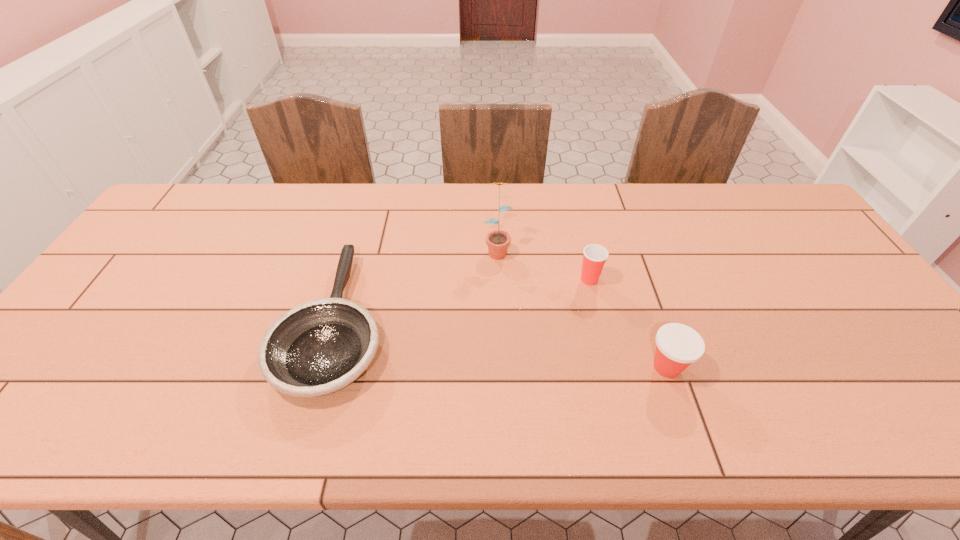
Where is `empty location between the tallest object and the second object from right to left`? empty location between the tallest object and the second object from right to left is located at coordinates 543,264.

The width and height of the screenshot is (960, 540). In order to click on free point between the second object from left to right and the shortest object in this screenshot , I will do `click(416, 286)`.

Where is `empty location between the tallest object and the farther Dixie cup`? empty location between the tallest object and the farther Dixie cup is located at coordinates click(x=543, y=264).

Locate an element on the screen. vacant space that is in between the frying pan and the second object from right to left is located at coordinates (463, 301).

At what (x,y) coordinates should I click in order to perform the action: click on vacant area between the right Dixie cup and the leftmost object. Please return your answer as a coordinate pair (x, y). This screenshot has height=540, width=960. Looking at the image, I should click on (501, 345).

The height and width of the screenshot is (540, 960). In order to click on unoccupied position between the second object from left to right and the second object from right to left in this screenshot , I will do `click(543, 264)`.

Where is `vacant space that is in between the left Dixie cup and the right Dixie cup`? The width and height of the screenshot is (960, 540). vacant space that is in between the left Dixie cup and the right Dixie cup is located at coordinates (628, 323).

Where is `blank region between the shortest object and the farther Dixie cup`? The width and height of the screenshot is (960, 540). blank region between the shortest object and the farther Dixie cup is located at coordinates (463, 301).

This screenshot has width=960, height=540. Identify the location of object that stands as the closest to the left Dixie cup. (497, 241).

Select which object is the second closest to the rightmost object. Please provide its 2D coordinates. Your answer should be formatted as a tuple, i.e. [(x, y)], where the tuple contains the x and y coordinates of a point satisfying the conditions above.

[(497, 241)]